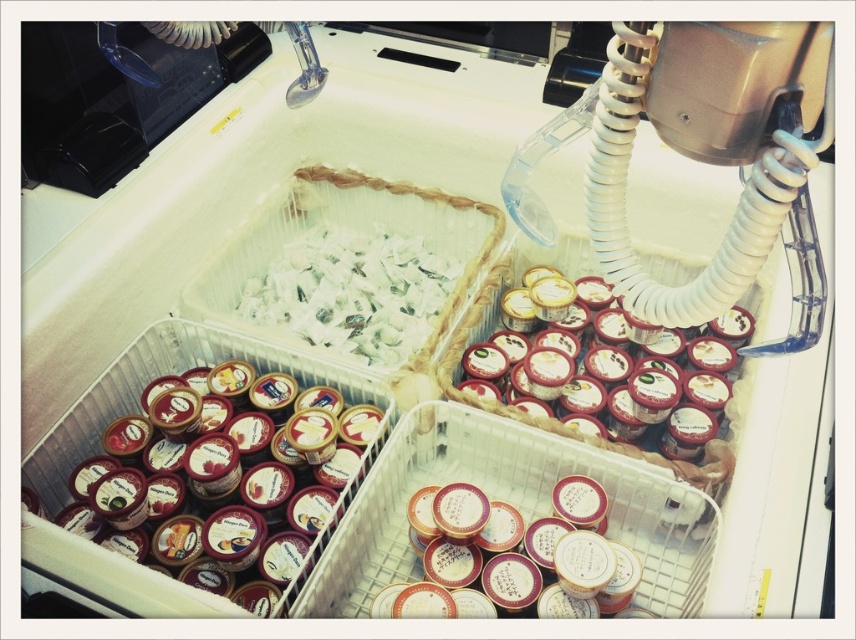
Which of these two, white paper at center or red glossy ice cream tubs at upper right, stands taller?

With more height is red glossy ice cream tubs at upper right.

Where is `white paper at center`? white paper at center is located at coordinates (352, 292).

Identify the location of white paper at center. [352, 292].

Can you confirm if matte plastic containers at lower left is bigger than white paper at center?

Correct, matte plastic containers at lower left is larger in size than white paper at center.

Identify the location of matte plastic containers at lower left. (254, 483).

Identify the location of matte plastic containers at lower left. Image resolution: width=856 pixels, height=640 pixels. (254, 483).

Can you confirm if matte plastic containers at lower left is positioned above red glossy ice cream tubs at upper right?

No.

Who is positioned more to the right, matte plastic containers at lower left or red glossy ice cream tubs at upper right?

red glossy ice cream tubs at upper right is more to the right.

What do you see at coordinates (254, 483) in the screenshot? This screenshot has width=856, height=640. I see `matte plastic containers at lower left` at bounding box center [254, 483].

The image size is (856, 640). What are the coordinates of `matte plastic containers at lower left` in the screenshot? It's located at (254, 483).